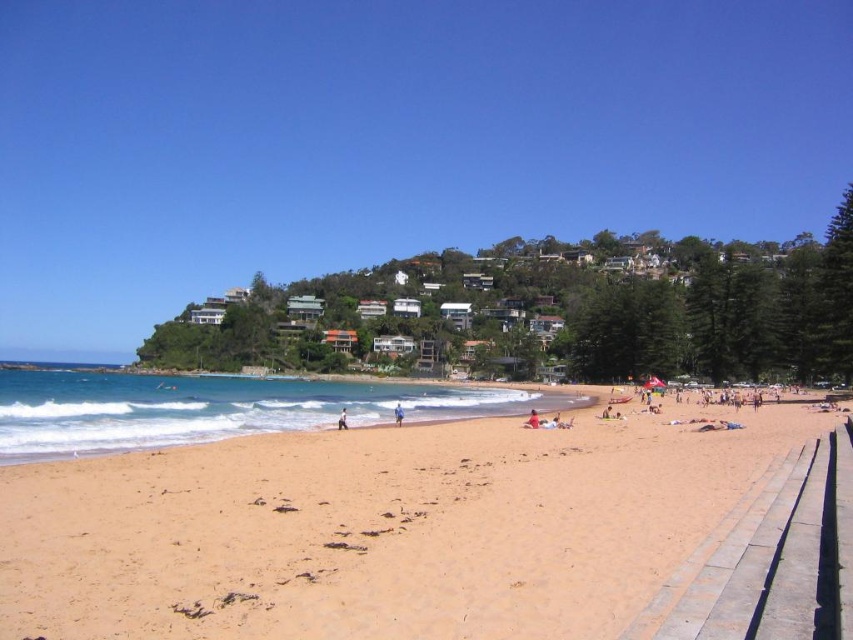
Question: In this image, where is green grass at upper center located relative to sandy beach at lower left?

Choices:
 (A) below
 (B) above

Answer: (B)

Question: Can you confirm if sandy beach at lower left is thinner than white fabric person at center?

Choices:
 (A) no
 (B) yes

Answer: (A)

Question: Among these objects, which one is nearest to the camera?

Choices:
 (A) red fabric person at center
 (B) sandy beach at lower left

Answer: (B)

Question: In this image, where is green grass at upper center located relative to blue fabric person at lower center?

Choices:
 (A) left
 (B) right

Answer: (A)

Question: Which point is farther from the camera taking this photo?

Choices:
 (A) (x=527, y=422)
 (B) (x=341, y=410)
 (C) (x=393, y=408)
 (D) (x=16, y=122)

Answer: (D)

Question: Which object is the farthest from the green grass at upper center?

Choices:
 (A) sandy beach at lower left
 (B) red fabric person at center

Answer: (A)